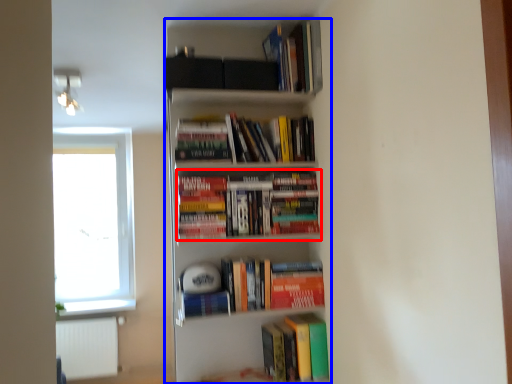
Question: Which object is closer to the camera taking this photo, book (highlighted by a red box) or bookcase (highlighted by a blue box)?

Choices:
 (A) book
 (B) bookcase

Answer: (B)